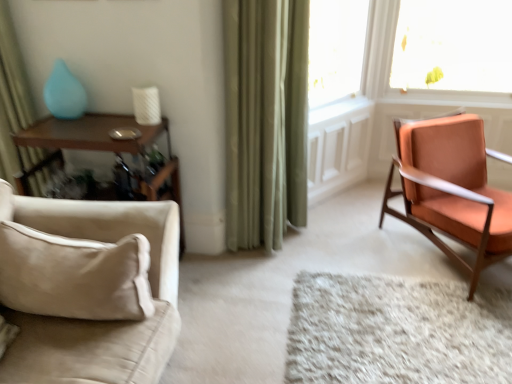
The height and width of the screenshot is (384, 512). I want to click on white shag rug at center, so click(x=396, y=331).

In order to face white shag rug at center, should I rotate leftwards or rightwards?

To face it directly, rotate right by 20.151 degrees.

Describe the element at coordinates (64, 93) in the screenshot. The height and width of the screenshot is (384, 512). I see `matte ceramic vase at upper left` at that location.

What are the coordinates of `matte ceramic vase at upper left` in the screenshot? It's located at (64, 93).

This screenshot has height=384, width=512. What do you see at coordinates (335, 49) in the screenshot?
I see `transparent glass window at upper right` at bounding box center [335, 49].

Locate an element on the screen. Image resolution: width=512 pixels, height=384 pixels. woodenmaterial/texturetable at left is located at coordinates (98, 149).

Is green fabric curtain at left, which is counted as the 1th curtain, starting from the left, in front of or behind beige fabric couch at lower left, which is the first chair in front-to-back order, in the image?

green fabric curtain at left, which is counted as the 1th curtain, starting from the left, is positioned farther from the viewer than beige fabric couch at lower left, which is the first chair in front-to-back order.

From the image's perspective, relative to beige fabric couch at lower left, which appears as the first chair when viewed from the left, is green fabric curtain at left, which is counted as the 1th curtain, starting from the left, above or below?

green fabric curtain at left, which is counted as the 1th curtain, starting from the left, is situated higher than beige fabric couch at lower left, which appears as the first chair when viewed from the left, in the image.

Can we say green fabric curtain at left, positioned as the 2th curtain in right-to-left order, lies outside beige fabric couch at lower left, which is the second chair in right-to-left order?

Yes, green fabric curtain at left, positioned as the 2th curtain in right-to-left order, is located beyond the bounds of beige fabric couch at lower left, which is the second chair in right-to-left order.

Does green fabric curtain at left, positioned as the 2th curtain in right-to-left order, appear on the left side of beige fabric couch at lower left, which appears as the first chair when viewed from the left?

Correct, you'll find green fabric curtain at left, positioned as the 2th curtain in right-to-left order, to the left of beige fabric couch at lower left, which appears as the first chair when viewed from the left.

Is matte ceramic vase at upper left to the right of green velvet curtain at center, acting as the 1th curtain starting from the right, from the viewer's perspective?

In fact, matte ceramic vase at upper left is to the left of green velvet curtain at center, acting as the 1th curtain starting from the right.

Find the location of a particular element. The height and width of the screenshot is (384, 512). curtain lying on the right of matte ceramic vase at upper left is located at coordinates coord(265,119).

Between matte ceramic vase at upper left and green velvet curtain at center, which is the second curtain from left to right, which one has less height?

matte ceramic vase at upper left is shorter.

Is matte ceramic vase at upper left positioned before green velvet curtain at center, acting as the 1th curtain starting from the right?

No, matte ceramic vase at upper left is behind green velvet curtain at center, acting as the 1th curtain starting from the right.

The height and width of the screenshot is (384, 512). Identify the location of table on the left of green velvet curtain at center, acting as the 1th curtain starting from the right. (98, 149).

Looking at this image, does woodenmaterial/texturetable at left touch green velvet curtain at center, acting as the 1th curtain starting from the right?

No, woodenmaterial/texturetable at left is not making contact with green velvet curtain at center, acting as the 1th curtain starting from the right.

Is woodenmaterial/texturetable at left inside the boundaries of green velvet curtain at center, which is the second curtain from left to right, or outside?

woodenmaterial/texturetable at left cannot be found inside green velvet curtain at center, which is the second curtain from left to right.

From a real-world perspective, is woodenmaterial/texturetable at left physically below green velvet curtain at center, which is the second curtain from left to right?

Yes, from a real-world perspective, woodenmaterial/texturetable at left is under green velvet curtain at center, which is the second curtain from left to right.

From a real-world perspective, which is physically below, beige fabric couch at lower left, positioned as the 2th chair in back-to-front order, or woodenmaterial/texturetable at left?

In real-world perspective, woodenmaterial/texturetable at left is lower.

What's the angular difference between beige fabric couch at lower left, positioned as the 2th chair in back-to-front order, and woodenmaterial/texturetable at left's facing directions?

87.3 degrees separate the facing orientations of beige fabric couch at lower left, positioned as the 2th chair in back-to-front order, and woodenmaterial/texturetable at left.

Can you confirm if beige fabric couch at lower left, which appears as the first chair when viewed from the left, is thinner than woodenmaterial/texturetable at left?

No.

Is point (60, 328) less distant than point (173, 180)?

Yes, point (60, 328) is closer to viewer.

Is matte ceramic vase at upper left closer to the viewer compared to woodenmaterial/texturetable at left?

No, matte ceramic vase at upper left is further to the viewer.

Based on the photo, could you tell me if matte ceramic vase at upper left is turned towards woodenmaterial/texturetable at left?

No, matte ceramic vase at upper left does not turn towards woodenmaterial/texturetable at left.

Do you think matte ceramic vase at upper left is within woodenmaterial/texturetable at left, or outside of it?

A: matte ceramic vase at upper left exists outside the volume of woodenmaterial/texturetable at left.

Considering the relative sizes of matte ceramic vase at upper left and woodenmaterial/texturetable at left in the image provided, is matte ceramic vase at upper left bigger than woodenmaterial/texturetable at left?

No.

Where is `table located above the white shag rug at center (from the image's perspective)`? Image resolution: width=512 pixels, height=384 pixels. table located above the white shag rug at center (from the image's perspective) is located at coordinates point(98,149).

Would you say white shag rug at center is outside woodenmaterial/texturetable at left?

Yes, white shag rug at center is outside of woodenmaterial/texturetable at left.

Is white shag rug at center smaller than woodenmaterial/texturetable at left?

Yes.

From the picture: Which is nearer, (240, 195) or (180, 213)?

Point (240, 195) is closer to the camera than point (180, 213).

From a real-world perspective, is green velvet curtain at center, acting as the 1th curtain starting from the right, over woodenmaterial/texturetable at left?

Yes, from a real-world perspective, green velvet curtain at center, acting as the 1th curtain starting from the right, is above woodenmaterial/texturetable at left.

How distant is green velvet curtain at center, acting as the 1th curtain starting from the right, from woodenmaterial/texturetable at left?

green velvet curtain at center, acting as the 1th curtain starting from the right, is 61.15 centimeters away from woodenmaterial/texturetable at left.

Would you say woodenmaterial/texturetable at left is part of green velvet curtain at center, acting as the 1th curtain starting from the right,'s contents?

No, woodenmaterial/texturetable at left is not a part of green velvet curtain at center, acting as the 1th curtain starting from the right.

I want to click on curtain located on the left of beige fabric couch at lower left, which is the second chair in right-to-left order, so click(x=12, y=96).

Locate an element on the screen. The width and height of the screenshot is (512, 384). turquoise behind the green velvet curtain at center, acting as the 1th curtain starting from the right is located at coordinates (64, 93).

When comparing their distances from green velvet curtain at center, which is the second curtain from left to right, does white shag rug at center or beige fabric couch at lower left, positioned as the 2th chair in back-to-front order, seem closer?

The object closer to green velvet curtain at center, which is the second curtain from left to right, is white shag rug at center.

Which object lies further to the anchor point orange fabric chair at right, arranged as the first chair when viewed from the right, woodenmaterial/texturetable at left or matte ceramic vase at upper left?

The object further to orange fabric chair at right, arranged as the first chair when viewed from the right, is matte ceramic vase at upper left.

Considering their positions, is transparent glass window at upper right positioned closer to beige fabric couch at lower left, which is the second chair in right-to-left order, than woodenmaterial/texturetable at left?

woodenmaterial/texturetable at left lies closer to beige fabric couch at lower left, which is the second chair in right-to-left order, than the other object.

Looking at the image, which one is located further to woodenmaterial/texturetable at left, green velvet curtain at center, acting as the 1th curtain starting from the right, or beige fabric couch at lower left, which appears as the first chair when viewed from the left?

green velvet curtain at center, acting as the 1th curtain starting from the right.

When comparing their distances from green fabric curtain at left, which is counted as the 1th curtain, starting from the left, does woodenmaterial/texturetable at left or orange fabric chair at right, the second chair when ordered from left to right, seem closer?

The object closer to green fabric curtain at left, which is counted as the 1th curtain, starting from the left, is woodenmaterial/texturetable at left.

Consider the image. From the image, which object appears to be nearer to green fabric curtain at left, positioned as the 2th curtain in right-to-left order, white shag rug at center or orange fabric chair at right, the 1th chair positioned from the back?

Based on the image, white shag rug at center appears to be nearer to green fabric curtain at left, positioned as the 2th curtain in right-to-left order.

Considering their positions, is transparent glass window at upper right positioned further to green velvet curtain at center, which is the second curtain from left to right, than beige fabric couch at lower left, which is the second chair in right-to-left order?

beige fabric couch at lower left, which is the second chair in right-to-left order.

Consider the image. Based on their spatial positions, is transparent glass window at upper right or green velvet curtain at center, acting as the 1th curtain starting from the right, further from orange fabric chair at right, the 1th chair positioned from the back?

transparent glass window at upper right is positioned further to the anchor orange fabric chair at right, the 1th chair positioned from the back.

This screenshot has height=384, width=512. I want to click on table between matte ceramic vase at upper left and white shag rug at center, so click(x=98, y=149).

Where is `curtain between woodenmaterial/texturetable at left and white shag rug at center from left to right`? The height and width of the screenshot is (384, 512). curtain between woodenmaterial/texturetable at left and white shag rug at center from left to right is located at coordinates (265, 119).

Locate an element on the screen. curtain between beige fabric couch at lower left, positioned as the 2th chair in back-to-front order, and white shag rug at center from left to right is located at coordinates (265, 119).

Where is `chair located between matte ceramic vase at upper left and white shag rug at center in the left-right direction`? chair located between matte ceramic vase at upper left and white shag rug at center in the left-right direction is located at coordinates (88, 289).